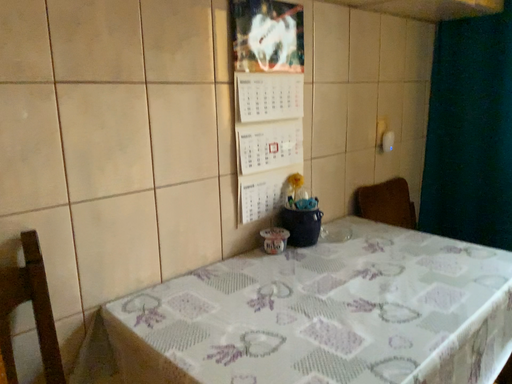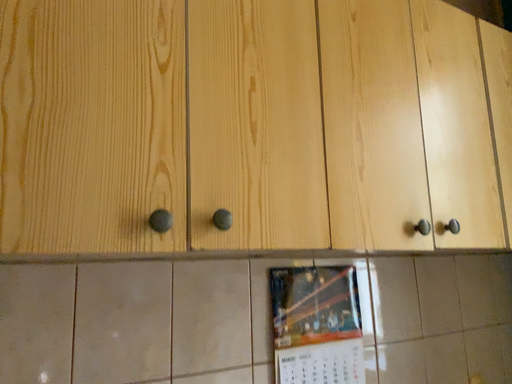
Question: Which way did the camera rotate in the video?

Choices:
 (A) rotated upward
 (B) rotated downward

Answer: (A)